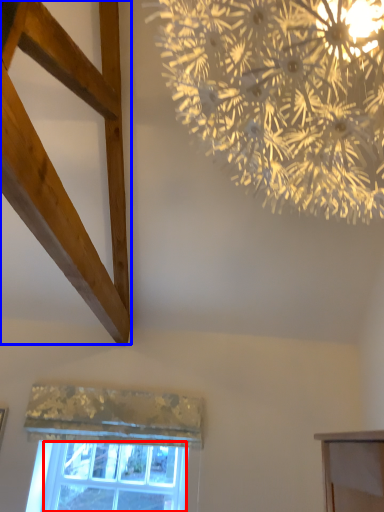
Question: Among these objects, which one is nearest to the camera, window screen (highlighted by a red box) or plank (highlighted by a blue box)?

Choices:
 (A) window screen
 (B) plank

Answer: (B)